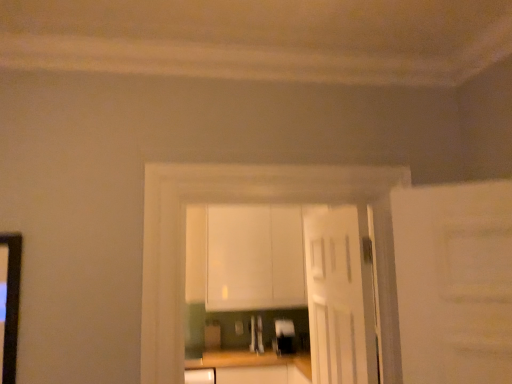
Question: Does wooden at center lie in front of white glossy cabinets at center?

Choices:
 (A) yes
 (B) no

Answer: (B)

Question: Is wooden at center next to white glossy cabinets at center and touching it?

Choices:
 (A) no
 (B) yes

Answer: (A)

Question: Can you confirm if wooden at center is smaller than white glossy cabinets at center?

Choices:
 (A) yes
 (B) no

Answer: (B)

Question: Is white glossy cabinets at center a part of wooden at center?

Choices:
 (A) yes
 (B) no

Answer: (B)

Question: Does wooden at center have a larger size compared to white glossy cabinets at center?

Choices:
 (A) yes
 (B) no

Answer: (A)

Question: From the image's perspective, would you say wooden at center is positioned over white glossy cabinets at center?

Choices:
 (A) yes
 (B) no

Answer: (B)

Question: Considering the relative sizes of metallic silver toaster at center, acting as the 2th appliance starting from the left, and wooden at center in the image provided, is metallic silver toaster at center, acting as the 2th appliance starting from the left, smaller than wooden at center?

Choices:
 (A) no
 (B) yes

Answer: (B)

Question: Is metallic silver toaster at center, the first appliance viewed from the right, wider than wooden at center?

Choices:
 (A) yes
 (B) no

Answer: (B)

Question: Is wooden at center inside metallic silver toaster at center, acting as the 2th appliance starting from the left?

Choices:
 (A) no
 (B) yes

Answer: (A)

Question: Is metallic silver toaster at center, the first appliance viewed from the right, oriented away from wooden at center?

Choices:
 (A) yes
 (B) no

Answer: (B)

Question: Can you confirm if metallic silver toaster at center, acting as the 2th appliance starting from the left, is bigger than wooden at center?

Choices:
 (A) yes
 (B) no

Answer: (B)

Question: Can we say metallic silver toaster at center, acting as the 2th appliance starting from the left, lies outside wooden at center?

Choices:
 (A) no
 (B) yes

Answer: (B)

Question: Can you confirm if satin silver toaster at center, acting as the first appliance starting from the left, is wider than white matte cabinet at center?

Choices:
 (A) yes
 (B) no

Answer: (B)